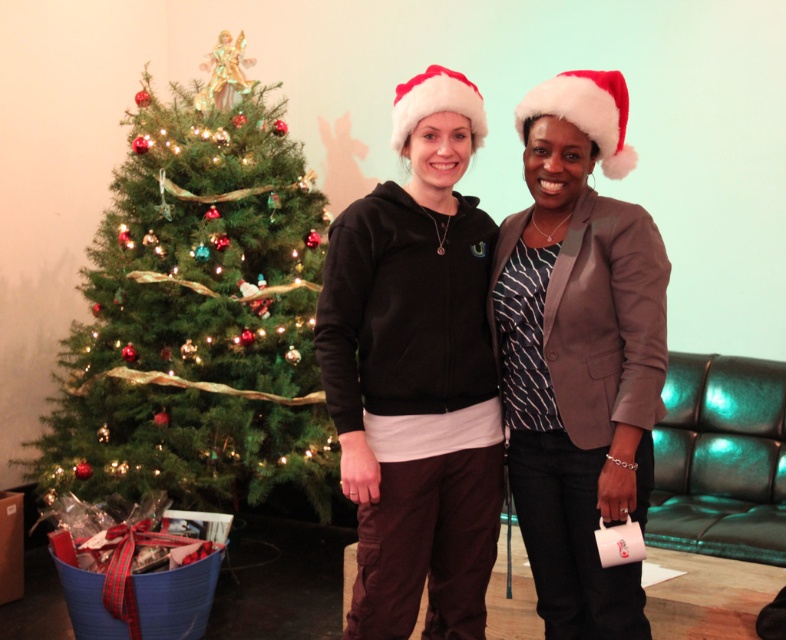
From the picture: You are at the festive indoor scene with two people wearing Santa hats. You see a point marked at coordinates (197, 310). Which object from the scene does this point belong to?

The point at coordinates (197, 310) is located on the green textured Christmas tree at left.

You are a photographer setting up for a holiday photo shoot. You need to position a light source to the right of the red velvet santa hat at upper center. Based on the scene, where should you place the light source relative to the green textured christmas tree at left?

The green textured christmas tree at left is to the left of the red velvet santa hat at upper center. Therefore, placing the light source to the right of the red velvet santa hat at upper center would mean positioning it to the right of the green textured christmas tree at left.

You are a photographer setting up for a holiday photo shoot. You notice the black soft hoodie at center and the red velvet santa hat at upper center in the scene. Which object is positioned farther to the left?

The black soft hoodie at center is positioned to the left of the red velvet santa hat at upper center, so it is farther to the left.